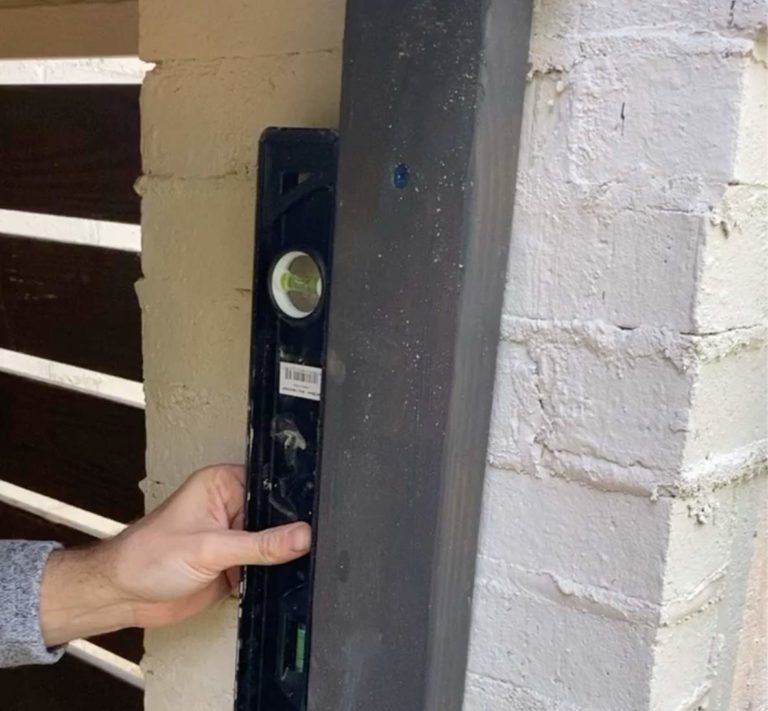
This screenshot has width=768, height=711. I want to click on inner wall, so click(222, 77).